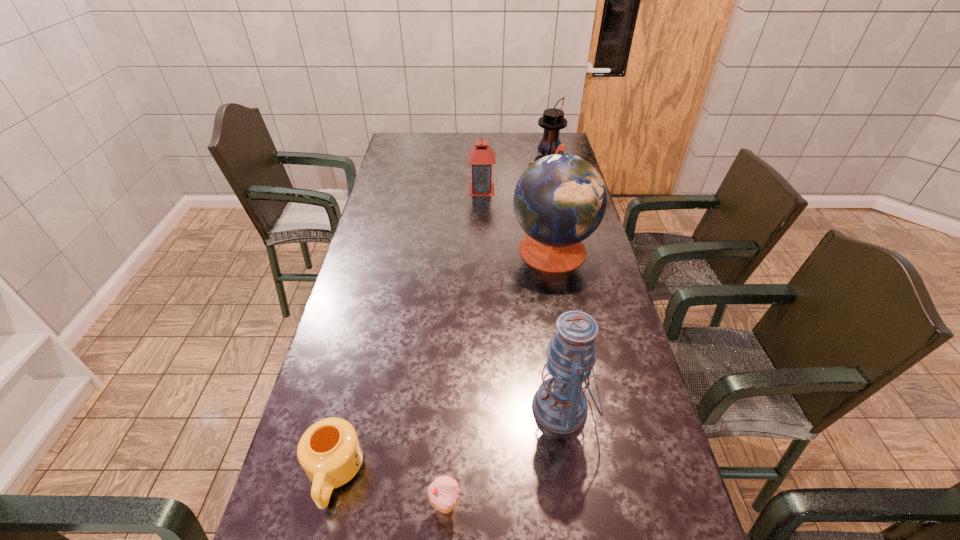
Find the location of a particular element. globe is located at coordinates (560, 200).

Image resolution: width=960 pixels, height=540 pixels. Find the location of `the farthest object`. the farthest object is located at coordinates (553, 120).

Locate an element on the screen. the nearest lantern is located at coordinates (560, 405).

Where is `the third shortest object`? The image size is (960, 540). the third shortest object is located at coordinates (481, 157).

Image resolution: width=960 pixels, height=540 pixels. I want to click on the second farthest lantern, so click(481, 157).

Image resolution: width=960 pixels, height=540 pixels. Find the location of `mug`. mug is located at coordinates (329, 451).

Identify the location of icecream. (444, 492).

Find the location of `vacant space located with the Americas facing the viewer on the globe`. vacant space located with the Americas facing the viewer on the globe is located at coordinates (440, 248).

You are a GUI agent. You are given a task and a screenshot of the screen. Output one action in this format:
    pyautogui.click(x=<x>, y=<y>)
    Task: Click on the free space located with the Americas facing the viewer on the globe
    This screenshot has width=960, height=540.
    Given the screenshot: What is the action you would take?
    pyautogui.click(x=479, y=248)

Find the location of `free space located 0.290m with the Americas facing the viewer on the globe`. free space located 0.290m with the Americas facing the viewer on the globe is located at coordinates (428, 248).